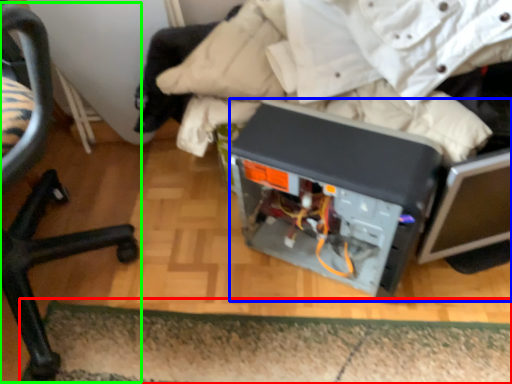
Question: Which object is the farthest from doormat (highlighted by a red box)? Choose among these: wide (highlighted by a blue box) or chair (highlighted by a green box).

Choices:
 (A) wide
 (B) chair

Answer: (B)